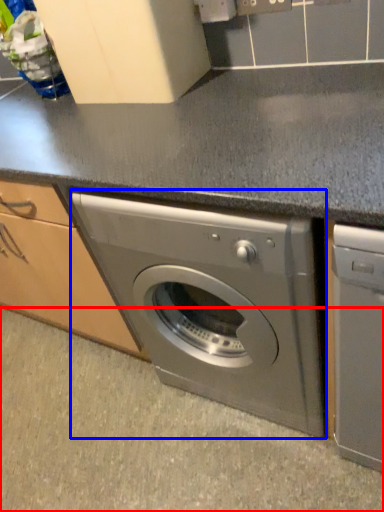
Question: Among these objects, which one is farthest to the camera, granite (highlighted by a red box) or washing machine (highlighted by a blue box)?

Choices:
 (A) granite
 (B) washing machine

Answer: (A)